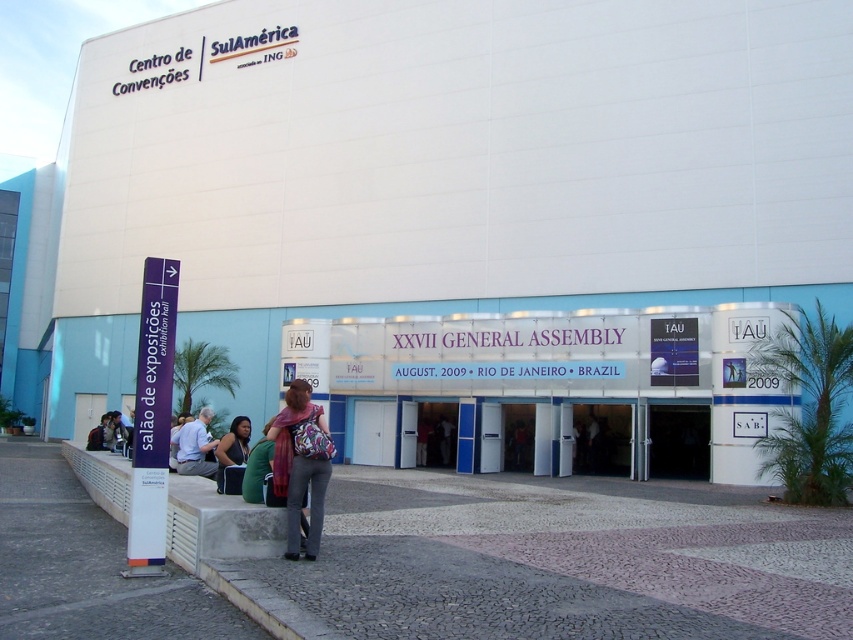
You are standing in front of the Centro de Convencoes SulAmERICA and want to read the signpost indicating the exhibition hall. Which object is closer to you, the white glossy signboard at center or the matte purple scarf at center?

The white glossy signboard at center is closer to you than the matte purple scarf at center.

You are standing in front of the Centro de Conven?es SulAm?rica and need to find the exhibition hall. There is a white glossy signboard at center. According to the signboard, where is the sal?o de exposi?es exhibition hall located?

The white glossy signboard at center indicates that the sal?o de exposi?es exhibition hall is located in front of the building, as the signpost with the vertical text points towards it.

You are standing in front of the Centro de Convencoes SulAmERICA and want to take a photo of the building. You notice two points marked on the ground at coordinates point (306, 323) and point (192, 449). Which point is closer to your camera position?

Point (192, 449) is closer to the camera position because it is nearer to the viewer compared to point (306, 323), which is further away.